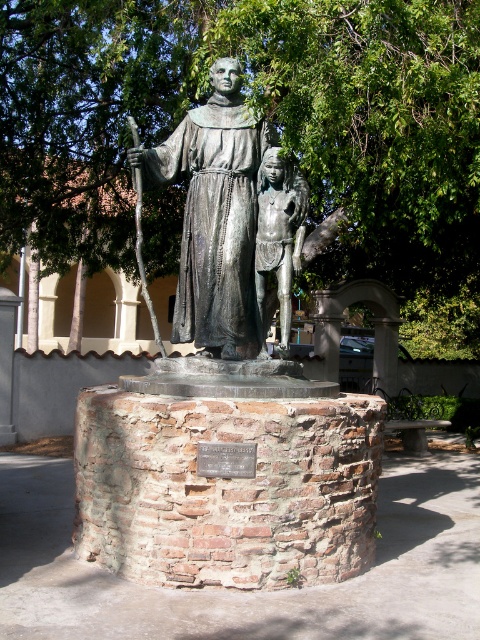
Question: Which object is closer to the camera taking this photo?

Choices:
 (A) bronze figure at center
 (B) green leafy tree at upper center
 (C) bronze statue at center

Answer: (C)

Question: From the image, what is the correct spatial relationship of bronze statue at center in relation to bronze figure at center?

Choices:
 (A) above
 (B) below

Answer: (A)

Question: Among these objects, which one is farthest from the camera?

Choices:
 (A) bronze statue at center
 (B) bronze figure at center
 (C) green leafy tree at upper center

Answer: (C)

Question: Does green leafy tree at upper center have a smaller size compared to bronze statue at center?

Choices:
 (A) yes
 (B) no

Answer: (B)

Question: Which point is closer to the camera taking this photo?

Choices:
 (A) (162, 250)
 (B) (291, 250)

Answer: (B)

Question: Can you confirm if green leafy tree at upper center is bigger than bronze statue at center?

Choices:
 (A) no
 (B) yes

Answer: (B)